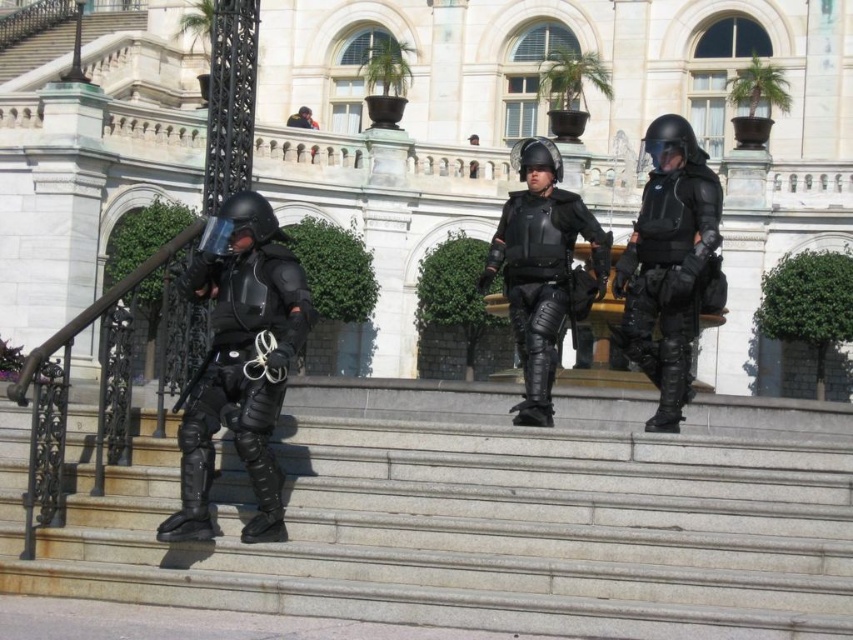
You are a photographer trying to capture a clear shot of the matte black armor at center from the gray stone stairs at center. Can you stand on the stairs to take the photo without blocking the armor?

The gray stone stairs at center is in front of the matte black armor at center, so standing on the stairs would block the view of the armor. Choose a different position to take the photo.

You are a photographer trying to capture a clear shot of both the matte black tactical suit at center and the matte black armor at center from your current position. Which object will appear larger in your photo?

The matte black tactical suit at center will appear larger in your photo because it is closer to the viewer than the matte black armor at center.

You are a drone operator trying to capture a clear image of the group of individuals in riot gear on the steps of the grand building. The point you are focusing on is at coordinates point [161,80]. If your camera has a maximum zoom range of 50 meters, will you be able to zoom in enough to capture their faces clearly?

The individuals are 92.71 meters away from the point [161,80], which exceeds the camera maximum zoom range of 50 meters. Therefore, you cannot zoom in enough to capture their faces clearly.